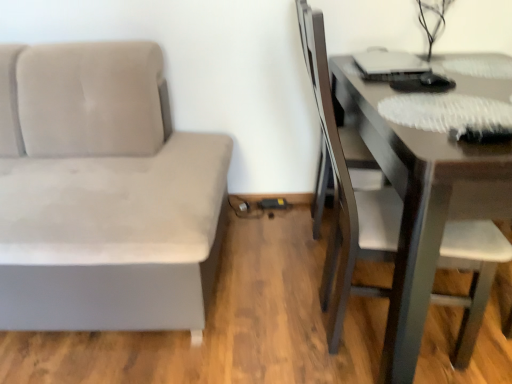
Question: Is point (202, 200) positioned closer to the camera than point (318, 44)?

Choices:
 (A) closer
 (B) farther

Answer: (B)

Question: Considering their positions, is suede gray couch at left located in front of or behind matte black swivel chair at right?

Choices:
 (A) front
 (B) behind

Answer: (A)

Question: Which of these objects is positioned farthest from the matte black swivel chair at right?

Choices:
 (A) suede gray couch at left
 (B) dark brown wooden table at right

Answer: (A)

Question: Based on their relative distances, which object is farther from the suede gray couch at left?

Choices:
 (A) matte black swivel chair at right
 (B) dark brown wooden table at right

Answer: (A)